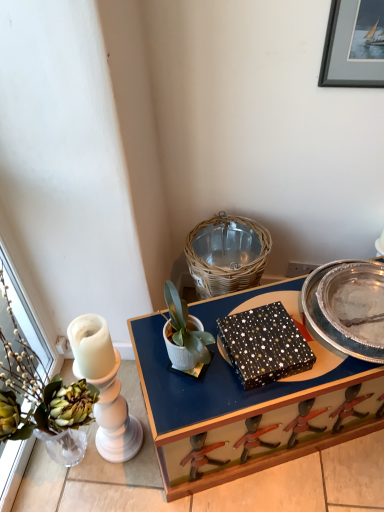
Where is `vacant area situated to the left side of white matte pot at center`? This screenshot has width=384, height=512. vacant area situated to the left side of white matte pot at center is located at coordinates (151, 350).